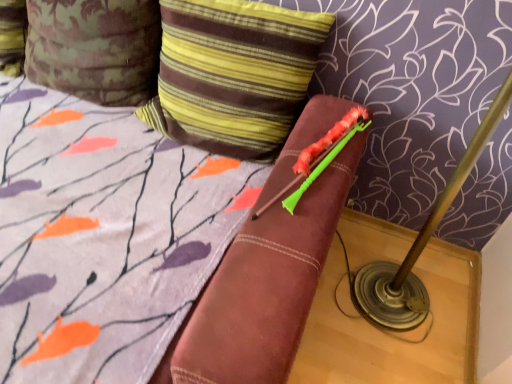
Question: Should I look upward or downward to see striped fabric pillow at upper center, the 2th pillow viewed from the left?

Choices:
 (A) down
 (B) up

Answer: (B)

Question: Is camouflage fabric pillow at upper left, marked as the 2th pillow in a right-to-left arrangement, turned away from striped fabric pillow at upper center, the 2th pillow viewed from the left?

Choices:
 (A) yes
 (B) no

Answer: (B)

Question: From a real-world perspective, does camouflage fabric pillow at upper left, marked as the 2th pillow in a right-to-left arrangement, sit lower than striped fabric pillow at upper center, the first pillow in the right-to-left sequence?

Choices:
 (A) no
 (B) yes

Answer: (A)

Question: Is camouflage fabric pillow at upper left, placed as the 1th pillow when sorted from left to right, shorter than striped fabric pillow at upper center, the 2th pillow viewed from the left?

Choices:
 (A) no
 (B) yes

Answer: (A)

Question: Is camouflage fabric pillow at upper left, placed as the 1th pillow when sorted from left to right, at the left side of striped fabric pillow at upper center, the first pillow in the right-to-left sequence?

Choices:
 (A) yes
 (B) no

Answer: (A)

Question: Is the depth of camouflage fabric pillow at upper left, placed as the 1th pillow when sorted from left to right, less than that of striped fabric pillow at upper center, the first pillow in the right-to-left sequence?

Choices:
 (A) yes
 (B) no

Answer: (B)

Question: Considering the relative sizes of camouflage fabric pillow at upper left, placed as the 1th pillow when sorted from left to right, and striped fabric pillow at upper center, the first pillow in the right-to-left sequence, in the image provided, is camouflage fabric pillow at upper left, placed as the 1th pillow when sorted from left to right, wider than striped fabric pillow at upper center, the first pillow in the right-to-left sequence,?

Choices:
 (A) no
 (B) yes

Answer: (B)

Question: Does striped fabric pillow at upper center, the 2th pillow viewed from the left, contain camouflage fabric pillow at upper left, placed as the 1th pillow when sorted from left to right?

Choices:
 (A) no
 (B) yes

Answer: (A)

Question: Can you confirm if striped fabric pillow at upper center, the 2th pillow viewed from the left, is positioned to the left of camouflage fabric pillow at upper left, placed as the 1th pillow when sorted from left to right?

Choices:
 (A) yes
 (B) no

Answer: (B)

Question: Considering the relative sizes of striped fabric pillow at upper center, the 2th pillow viewed from the left, and camouflage fabric pillow at upper left, placed as the 1th pillow when sorted from left to right, in the image provided, is striped fabric pillow at upper center, the 2th pillow viewed from the left, bigger than camouflage fabric pillow at upper left, placed as the 1th pillow when sorted from left to right,?

Choices:
 (A) yes
 (B) no

Answer: (A)

Question: Is striped fabric pillow at upper center, the 2th pillow viewed from the left, to the right of camouflage fabric pillow at upper left, placed as the 1th pillow when sorted from left to right, from the viewer's perspective?

Choices:
 (A) yes
 (B) no

Answer: (A)

Question: Does striped fabric pillow at upper center, the first pillow in the right-to-left sequence, have a lesser width compared to camouflage fabric pillow at upper left, placed as the 1th pillow when sorted from left to right?

Choices:
 (A) no
 (B) yes

Answer: (B)

Question: From a real-world perspective, is striped fabric pillow at upper center, the 2th pillow viewed from the left, located higher than camouflage fabric pillow at upper left, placed as the 1th pillow when sorted from left to right?

Choices:
 (A) no
 (B) yes

Answer: (A)

Question: From a real-world perspective, relative to striped fabric pillow at upper center, the 2th pillow viewed from the left, is camouflage fabric pillow at upper left, placed as the 1th pillow when sorted from left to right, vertically above or below?

Choices:
 (A) above
 (B) below

Answer: (A)